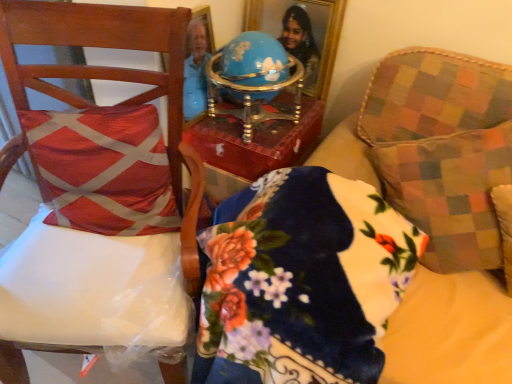
Question: From the image's perspective, is floral velvet pillow at center below multicolored checkered throw pillow at right, the second throw pillow viewed from the left?

Choices:
 (A) no
 (B) yes

Answer: (B)

Question: Can you confirm if floral velvet pillow at center is smaller than multicolored checkered throw pillow at right, which appears as the first throw pillow when viewed from the right?

Choices:
 (A) yes
 (B) no

Answer: (B)

Question: Is floral velvet pillow at center to the right of multicolored checkered throw pillow at right, which appears as the first throw pillow when viewed from the right, from the viewer's perspective?

Choices:
 (A) yes
 (B) no

Answer: (B)

Question: From a real-world perspective, is floral velvet pillow at center positioned over multicolored checkered throw pillow at right, the second throw pillow viewed from the left, based on gravity?

Choices:
 (A) no
 (B) yes

Answer: (A)

Question: Would you consider floral velvet pillow at center to be distant from multicolored checkered throw pillow at right, which appears as the first throw pillow when viewed from the right?

Choices:
 (A) yes
 (B) no

Answer: (B)

Question: Is floral velvet pillow at center looking in the opposite direction of multicolored checkered throw pillow at right, which appears as the first throw pillow when viewed from the right?

Choices:
 (A) no
 (B) yes

Answer: (B)

Question: Is multicolored checkered throw pillow at right, the second throw pillow viewed from the left, looking in the opposite direction of wooden chair at left?

Choices:
 (A) no
 (B) yes

Answer: (A)

Question: Can you confirm if multicolored checkered throw pillow at right, the second throw pillow viewed from the left, is thinner than wooden chair at left?

Choices:
 (A) no
 (B) yes

Answer: (B)

Question: Considering the relative positions of multicolored checkered throw pillow at right, the second throw pillow viewed from the left, and wooden chair at left in the image provided, is multicolored checkered throw pillow at right, the second throw pillow viewed from the left, to the right of wooden chair at left from the viewer's perspective?

Choices:
 (A) no
 (B) yes

Answer: (B)

Question: Can we say multicolored checkered throw pillow at right, which appears as the first throw pillow when viewed from the right, lies outside wooden chair at left?

Choices:
 (A) no
 (B) yes

Answer: (B)

Question: Does multicolored checkered throw pillow at right, the second throw pillow viewed from the left, have a greater height compared to wooden chair at left?

Choices:
 (A) yes
 (B) no

Answer: (B)

Question: Considering the relative sizes of multicolored checkered throw pillow at right, which appears as the first throw pillow when viewed from the right, and wooden chair at left in the image provided, is multicolored checkered throw pillow at right, which appears as the first throw pillow when viewed from the right, shorter than wooden chair at left?

Choices:
 (A) no
 (B) yes

Answer: (B)

Question: Is wooden chair at left at the back of red textured cushion at left, the first throw pillow positioned from the left?

Choices:
 (A) yes
 (B) no

Answer: (B)